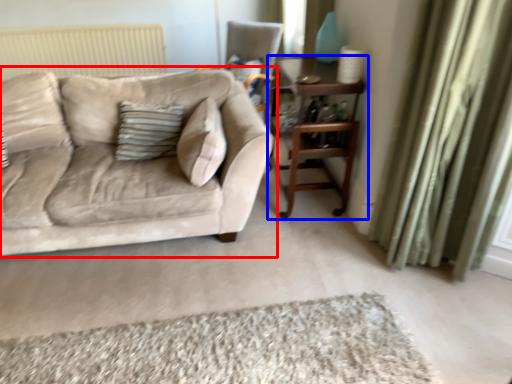
Question: Which object appears farthest to the camera in this image, studio couch (highlighted by a red box) or table (highlighted by a blue box)?

Choices:
 (A) studio couch
 (B) table

Answer: (B)